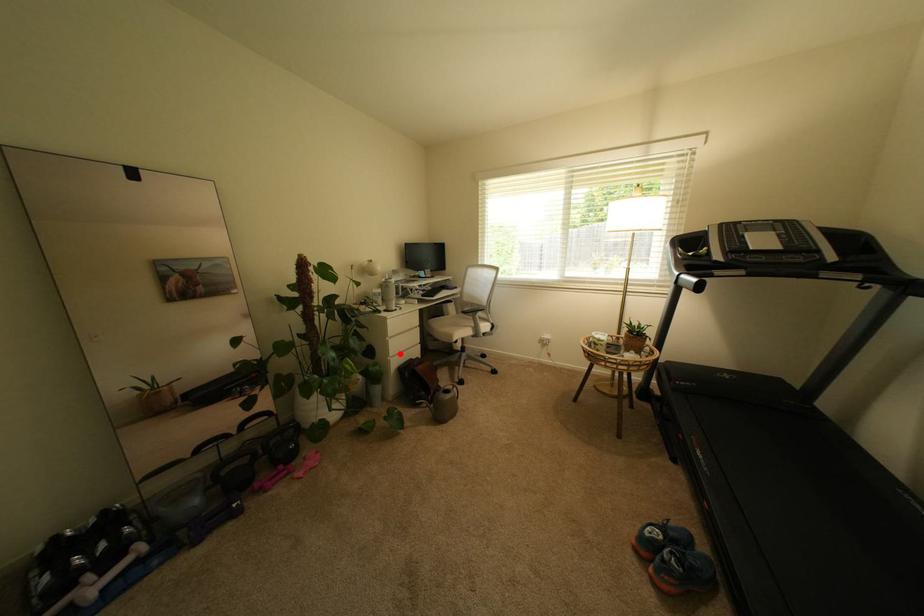
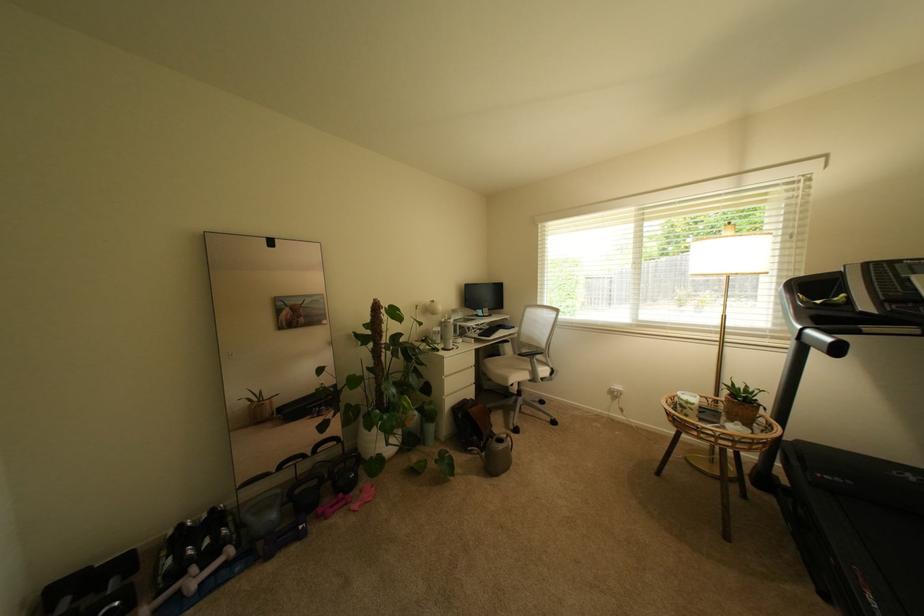
Find the pixel in the second image that matches the highlighted location in the first image.

(455, 392)